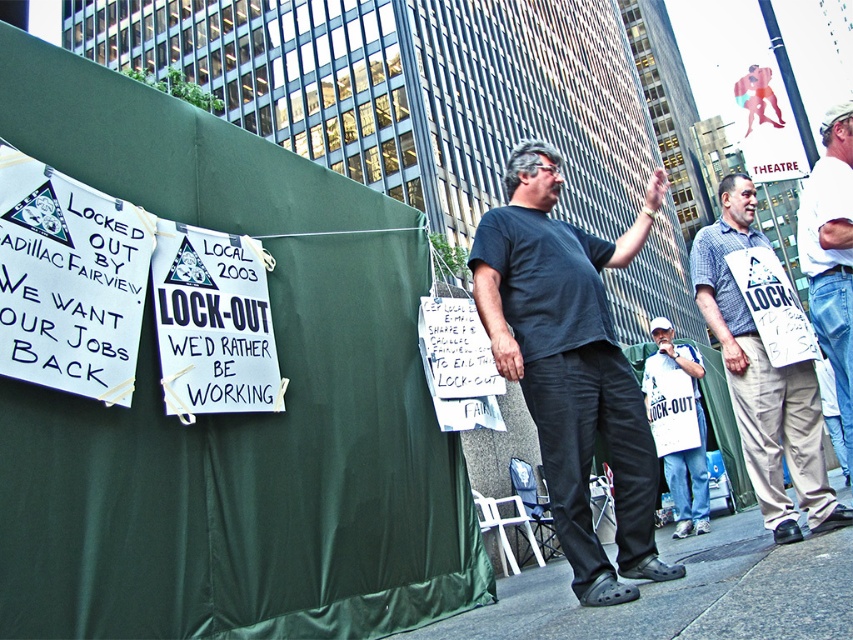
Question: Does dark gray t-shirt at center have a larger size compared to gray concrete sidewalk at lower center?

Choices:
 (A) no
 (B) yes

Answer: (A)

Question: Which object is the farthest from the white denim jeans at right?

Choices:
 (A) gray concrete sidewalk at lower center
 (B) plaid shirt at center
 (C) white paper sign at lower right
 (D) dark gray t-shirt at center

Answer: (C)

Question: Is gray concrete sidewalk at lower center positioned at the back of white paper sign at lower right?

Choices:
 (A) yes
 (B) no

Answer: (B)

Question: Which of these objects is positioned farthest from the white paper sign at lower right?

Choices:
 (A) plaid shirt at center
 (B) dark gray t-shirt at center
 (C) white denim jeans at right
 (D) gray concrete sidewalk at lower center

Answer: (B)

Question: Which of the following is the farthest from the observer?

Choices:
 (A) dark gray t-shirt at center
 (B) plaid shirt at center
 (C) gray concrete sidewalk at lower center
 (D) white denim jeans at right

Answer: (B)

Question: Is gray concrete sidewalk at lower center below white paper sign at lower right?

Choices:
 (A) no
 (B) yes

Answer: (B)